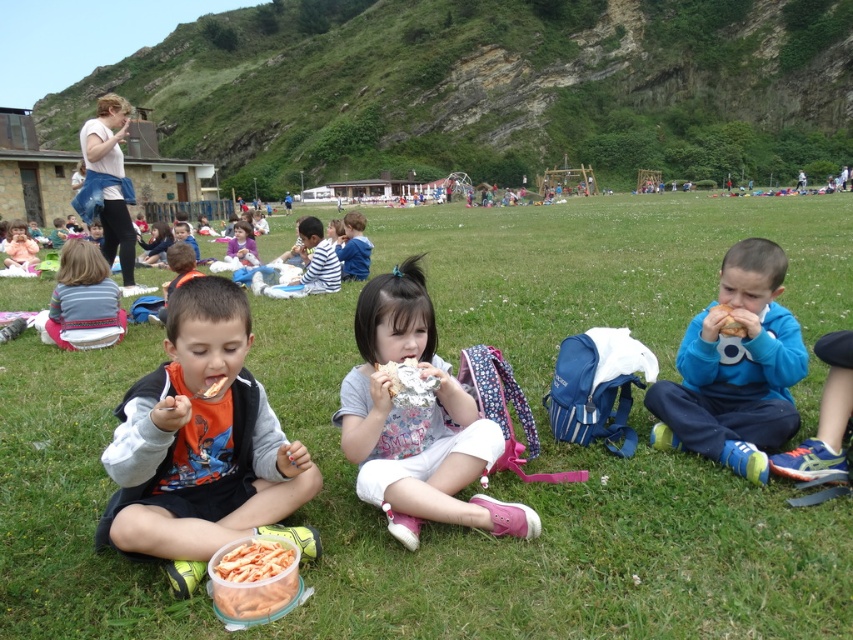
Question: Can you confirm if translucent plastic container of shrimp at center is smaller than matte pink backpack at center?

Choices:
 (A) no
 (B) yes

Answer: (B)

Question: Among these points, which one is farthest from the camera?

Choices:
 (A) (422, 403)
 (B) (248, 264)
 (C) (223, 604)

Answer: (B)

Question: Among these objects, which one is nearest to the camera?

Choices:
 (A) pink fabric backpack at center
 (B) brown bread at center

Answer: (A)

Question: Observing the image, what is the correct spatial positioning of green grass at center in reference to orange fabric shirt at center?

Choices:
 (A) above
 (B) below

Answer: (A)

Question: Which point is closer to the camera?

Choices:
 (A) (235, 246)
 (B) (334, 496)

Answer: (B)

Question: Considering the relative positions of pink fabric backpack at center and blue fleece jacket at right in the image provided, where is pink fabric backpack at center located with respect to blue fleece jacket at right?

Choices:
 (A) below
 (B) above

Answer: (A)